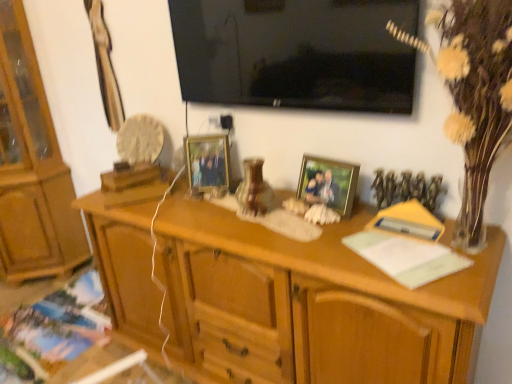
What do you see at coordinates (307, 298) in the screenshot? The width and height of the screenshot is (512, 384). I see `wooden desk at center` at bounding box center [307, 298].

The height and width of the screenshot is (384, 512). Describe the element at coordinates (406, 257) in the screenshot. I see `white paper at right, which is the second book in left-to-right order` at that location.

Measure the distance between matte paper book at lower left, the third book in the front-to-back sequence, and camera.

They are 1.95 meters apart.

Measure the distance between point (30, 286) and camera.

A distance of 8.67 feet exists between point (30, 286) and camera.

How much space does metallic gold picture frame at center, which is counted as the 1th picture frame, starting from the right, occupy vertically?

7.09 inches.

Locate an element on the screen. The width and height of the screenshot is (512, 384). light brown wood cabinet at left is located at coordinates (32, 167).

In order to face yellow paper at right, arranged as the 2th book when viewed from the front, should I rotate leftwards or rightwards?

Turn right by 19.823 degrees to look at yellow paper at right, arranged as the 2th book when viewed from the front.

Identify the location of wooden desk at center. This screenshot has width=512, height=384. 307,298.

Considering the sizes of yellow paper at right, which ranks as the third book in left-to-right order, and matte wooden picture frame at center, which is counted as the second picture frame, starting from the front, in the image, is yellow paper at right, which ranks as the third book in left-to-right order, bigger or smaller than matte wooden picture frame at center, which is counted as the second picture frame, starting from the front,?

In the image, yellow paper at right, which ranks as the third book in left-to-right order, appears to be smaller than matte wooden picture frame at center, which is counted as the second picture frame, starting from the front.

From the image's perspective, is yellow paper at right, which is counted as the 2th book, starting from the back, located above matte wooden picture frame at center, marked as the first picture frame in a back-to-front arrangement?

Incorrect, from the image's perspective, yellow paper at right, which is counted as the 2th book, starting from the back, is lower than matte wooden picture frame at center, marked as the first picture frame in a back-to-front arrangement.

The height and width of the screenshot is (384, 512). What are the coordinates of `the 2nd picture frame behind the yellow paper at right, which appears as the first book when viewed from the right, starting your count from the anchor` in the screenshot? It's located at coord(207,163).

Is point (422, 237) closer to camera compared to point (203, 178)?

Yes.

Is light brown wood cabinet at left wider or thinner than metallic gold picture frame at center, the second picture frame positioned from the left?

Considering their sizes, light brown wood cabinet at left looks broader than metallic gold picture frame at center, the second picture frame positioned from the left.

Considering the positions of objects light brown wood cabinet at left and metallic gold picture frame at center, which is counted as the 1th picture frame, starting from the right, in the image provided, who is in front, light brown wood cabinet at left or metallic gold picture frame at center, which is counted as the 1th picture frame, starting from the right,?

metallic gold picture frame at center, which is counted as the 1th picture frame, starting from the right.

I want to click on cabinetry on the left of metallic gold picture frame at center, the second picture frame positioned from the left, so click(x=32, y=167).

Could you measure the distance between matte paper book at lower left, arranged as the 3th book when viewed from the right, and matte wooden picture frame at center, arranged as the second picture frame when viewed from the right?

A distance of 4.07 feet exists between matte paper book at lower left, arranged as the 3th book when viewed from the right, and matte wooden picture frame at center, arranged as the second picture frame when viewed from the right.

Considering the sizes of objects matte paper book at lower left, which ranks as the 1th book in left-to-right order, and matte wooden picture frame at center, marked as the first picture frame in a back-to-front arrangement, in the image provided, who is thinner, matte paper book at lower left, which ranks as the 1th book in left-to-right order, or matte wooden picture frame at center, marked as the first picture frame in a back-to-front arrangement,?

matte wooden picture frame at center, marked as the first picture frame in a back-to-front arrangement, is thinner.

Is matte paper book at lower left, arranged as the 3th book when viewed from the right, turned away from matte wooden picture frame at center, which appears as the first picture frame when viewed from the left?

That's not correct — matte paper book at lower left, arranged as the 3th book when viewed from the right, is not looking away from matte wooden picture frame at center, which appears as the first picture frame when viewed from the left.

Based on the photo, from the image's perspective, which object appears higher, matte paper book at lower left, arranged as the 3th book when viewed from the right, or matte wooden picture frame at center, marked as the first picture frame in a back-to-front arrangement?

matte wooden picture frame at center, marked as the first picture frame in a back-to-front arrangement, from the image's perspective.

Is matte paper book at lower left, the third book in the front-to-back sequence, located within white paper at right, placed as the first book when sorted from front to back?

That's incorrect, matte paper book at lower left, the third book in the front-to-back sequence, is not inside white paper at right, placed as the first book when sorted from front to back.

Can you confirm if white paper at right, placed as the first book when sorted from front to back, is taller than matte paper book at lower left, the third book in the front-to-back sequence?

Yes, white paper at right, placed as the first book when sorted from front to back, is taller than matte paper book at lower left, the third book in the front-to-back sequence.

Is white paper at right, arranged as the 2th book when ordered from the bottom, facing towards matte paper book at lower left, which ranks as the 1th book in left-to-right order?

No, white paper at right, arranged as the 2th book when ordered from the bottom, is not turned towards matte paper book at lower left, which ranks as the 1th book in left-to-right order.

Who is smaller, white paper at right, placed as the 2th book when sorted from right to left, or matte paper book at lower left, acting as the third book starting from the top?

With smaller size is white paper at right, placed as the 2th book when sorted from right to left.

Is white paper at right, arranged as the 3th book when viewed from the back, looking in the opposite direction of matte wooden picture frame at center, arranged as the second picture frame when viewed from the right?

No, white paper at right, arranged as the 3th book when viewed from the back, is not facing away from matte wooden picture frame at center, arranged as the second picture frame when viewed from the right.

Is white paper at right, which is the second book in left-to-right order, not near matte wooden picture frame at center, which is counted as the second picture frame, starting from the front?

white paper at right, which is the second book in left-to-right order, is near matte wooden picture frame at center, which is counted as the second picture frame, starting from the front, not far away.

Does point (443, 247) come in front of point (196, 146)?

Yes, it is in front of point (196, 146).

Considering the positions of objects white paper at right, arranged as the 2th book when ordered from the bottom, and matte wooden picture frame at center, arranged as the second picture frame when viewed from the right, in the image provided, who is more to the left, white paper at right, arranged as the 2th book when ordered from the bottom, or matte wooden picture frame at center, arranged as the second picture frame when viewed from the right,?

matte wooden picture frame at center, arranged as the second picture frame when viewed from the right.

You are a GUI agent. You are given a task and a screenshot of the screen. Output one action in this format:
    pyautogui.click(x=<x>, y=<y>)
    Task: Click on the book below the wooden desk at center (from a real-world perspective)
    
    Given the screenshot: What is the action you would take?
    pyautogui.click(x=49, y=325)

Could you tell me if matte paper book at lower left, acting as the third book starting from the top, is facing wooden desk at center?

No, matte paper book at lower left, acting as the third book starting from the top, is not facing towards wooden desk at center.

Does matte paper book at lower left, marked as the 1th book in a bottom-to-top arrangement, touch wooden desk at center?

matte paper book at lower left, marked as the 1th book in a bottom-to-top arrangement, and wooden desk at center are clearly separated.

Which is correct: matte paper book at lower left, the third book in the front-to-back sequence, is inside wooden desk at center, or outside of it?

matte paper book at lower left, the third book in the front-to-back sequence, is not enclosed by wooden desk at center.

In terms of width, does wooden desk at center look wider or thinner when compared to white textured vase at right?

Considering their sizes, wooden desk at center looks broader than white textured vase at right.

From the image's perspective, relative to white textured vase at right, is wooden desk at center above or below?

From the image's perspective, wooden desk at center appears below white textured vase at right.

Is wooden desk at center positioned before white textured vase at right?

No, wooden desk at center is further to the viewer.

Can you tell me how much wooden desk at center and white textured vase at right differ in facing direction?

The angular difference between wooden desk at center and white textured vase at right is 1.51 degrees.

What are the coordinates of `the 1st book in front of the matte wooden picture frame at center, which appears as the first picture frame when viewed from the left` in the screenshot? It's located at (408, 221).

Locate an element on the screen. This screenshot has width=512, height=384. cabinetry that is above the metallic gold picture frame at center, which is counted as the 1th picture frame, starting from the right (from the image's perspective) is located at coordinates (32, 167).

Estimate the real-world distances between objects in this image. Which object is closer to yellow paper at right, which appears as the first book when viewed from the right, white paper at right, placed as the first book when sorted from front to back, or matte paper book at lower left, arranged as the 3th book when viewed from the right?

white paper at right, placed as the first book when sorted from front to back, lies closer to yellow paper at right, which appears as the first book when viewed from the right, than the other object.

From the image, which object appears to be nearer to yellow paper at right, positioned as the third book in bottom-to-top order, white textured vase at right or matte wooden picture frame at center, which is counted as the second picture frame, starting from the front?

white textured vase at right.

Looking at the image, which one is located closer to matte paper book at lower left, arranged as the 3th book when viewed from the right, white textured vase at right or metallic gold picture frame at center, acting as the 2th picture frame starting from the back?

metallic gold picture frame at center, acting as the 2th picture frame starting from the back, is closer to matte paper book at lower left, arranged as the 3th book when viewed from the right.

Which object lies further to the anchor point white textured vase at right, metallic gold picture frame at center, acting as the 2th picture frame starting from the back, or wooden desk at center?

Based on the image, wooden desk at center appears to be further to white textured vase at right.

From the image, which object appears to be farther from black glossy tv at upper center, metallic gold picture frame at center, which is counted as the 1th picture frame, starting from the right, or wooden desk at center?

Based on the image, wooden desk at center appears to be further to black glossy tv at upper center.

Estimate the real-world distances between objects in this image. Which object is further from metallic gold picture frame at center, acting as the 2th picture frame starting from the back, white paper at right, arranged as the 2th book when ordered from the bottom, or matte paper book at lower left, the third book in the front-to-back sequence?

The object further to metallic gold picture frame at center, acting as the 2th picture frame starting from the back, is matte paper book at lower left, the third book in the front-to-back sequence.

When comparing their distances from black glossy tv at upper center, does wooden desk at center or white paper at right, placed as the first book when sorted from front to back, seem further?

wooden desk at center is positioned further to the anchor black glossy tv at upper center.

Considering their positions, is light brown wood cabinet at left positioned closer to white textured vase at right than matte wooden picture frame at center, which appears as the first picture frame when viewed from the left?

matte wooden picture frame at center, which appears as the first picture frame when viewed from the left.

The height and width of the screenshot is (384, 512). What are the coordinates of `desk located between matte paper book at lower left, the third book in the front-to-back sequence, and yellow paper at right, which ranks as the third book in left-to-right order, in the left-right direction` in the screenshot? It's located at coord(307,298).

Where is `picture frame between light brown wood cabinet at left and wooden desk at center`? picture frame between light brown wood cabinet at left and wooden desk at center is located at coordinates (207, 163).

Where is `picture frame between matte wooden picture frame at center, which appears as the first picture frame when viewed from the left, and white paper at right, which is the second book in left-to-right order, in the horizontal direction`? picture frame between matte wooden picture frame at center, which appears as the first picture frame when viewed from the left, and white paper at right, which is the second book in left-to-right order, in the horizontal direction is located at coordinates pyautogui.click(x=328, y=183).

Identify the location of desk between light brown wood cabinet at left and white paper at right, placed as the first book when sorted from front to back, in the horizontal direction. (307, 298).